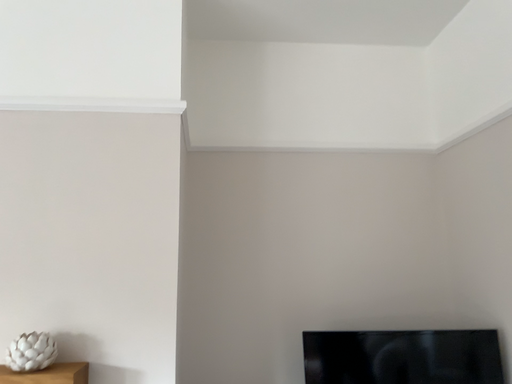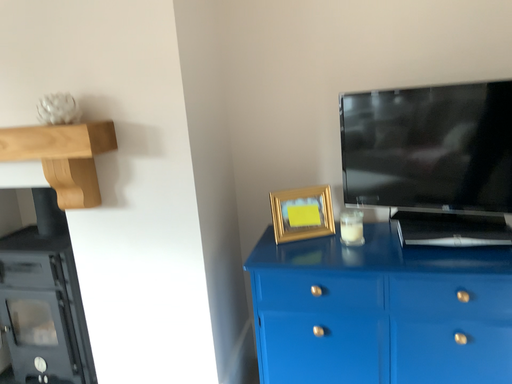
Question: How did the camera likely rotate when shooting the video?

Choices:
 (A) rotated right
 (B) rotated left

Answer: (B)